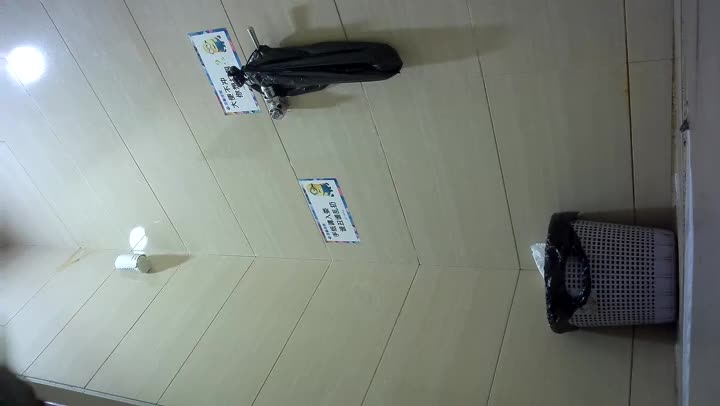
This screenshot has height=406, width=720. I want to click on wall, so click(463, 293), click(468, 146).